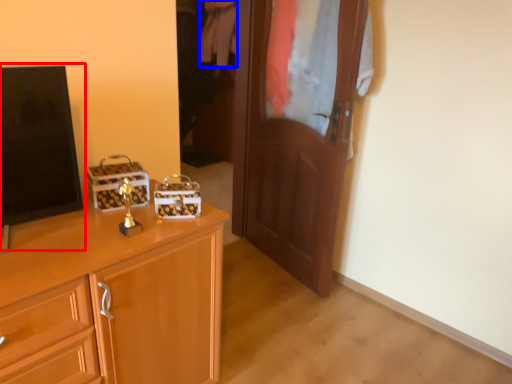
Question: Which object appears closest to the camera in this image, tv show (highlighted by a red box) or clothing (highlighted by a blue box)?

Choices:
 (A) tv show
 (B) clothing

Answer: (A)